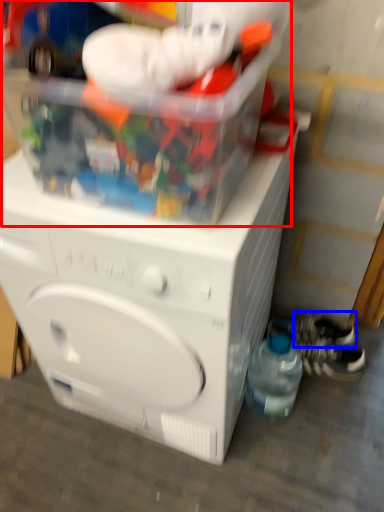
Question: Which object is further to the camera taking this photo, toy (highlighted by a red box) or shoe (highlighted by a blue box)?

Choices:
 (A) toy
 (B) shoe

Answer: (B)